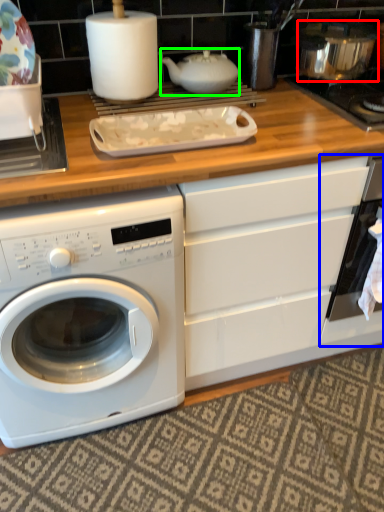
Question: Which object is positioned closest to appliance (highlighted by a red box)? Select from oven (highlighted by a blue box) and tea pot (highlighted by a green box).

Choices:
 (A) oven
 (B) tea pot

Answer: (B)